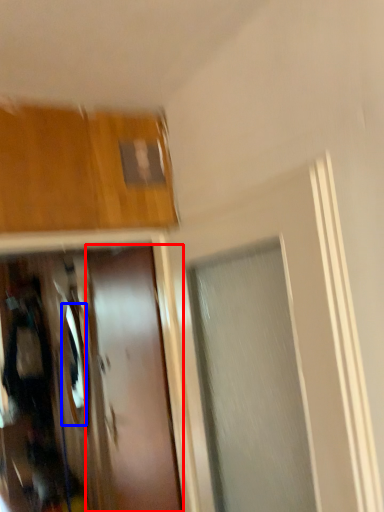
Question: Which object appears closest to the camera in this image, door (highlighted by a red box) or mirror (highlighted by a blue box)?

Choices:
 (A) door
 (B) mirror

Answer: (A)